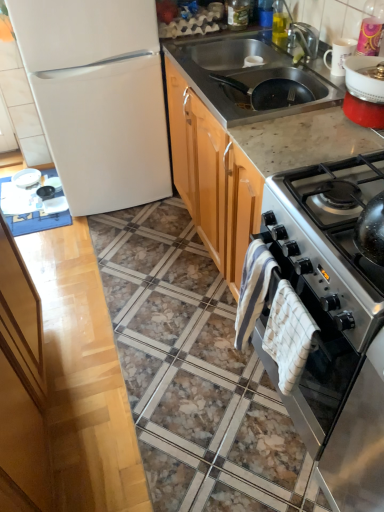
Question: From a real-world perspective, is satin silver oven at right over white glossy plate at upper left, the first appliance in the back-to-front sequence?

Choices:
 (A) yes
 (B) no

Answer: (A)

Question: Is satin silver oven at right oriented towards white glossy plate at upper left, which is counted as the 2th appliance, starting from the right?

Choices:
 (A) no
 (B) yes

Answer: (A)

Question: Are satin silver oven at right and white glossy plate at upper left, the first appliance positioned from the bottom, making contact?

Choices:
 (A) yes
 (B) no

Answer: (B)

Question: Considering the relative sizes of satin silver oven at right and white glossy plate at upper left, the 2th appliance positioned from the front, in the image provided, is satin silver oven at right bigger than white glossy plate at upper left, the 2th appliance positioned from the front,?

Choices:
 (A) yes
 (B) no

Answer: (A)

Question: Considering the relative sizes of satin silver oven at right and white glossy plate at upper left, the first appliance positioned from the bottom, in the image provided, is satin silver oven at right wider than white glossy plate at upper left, the first appliance positioned from the bottom,?

Choices:
 (A) no
 (B) yes

Answer: (B)

Question: In the image, is satin silver oven at right positioned in front of or behind white glossy plate at upper left, the first appliance in the back-to-front sequence?

Choices:
 (A) behind
 (B) front

Answer: (B)

Question: From a real-world perspective, is satin silver oven at right above or below white glossy plate at upper left, the first appliance positioned from the bottom?

Choices:
 (A) below
 (B) above

Answer: (B)

Question: From the image's perspective, is satin silver oven at right located above or below white glossy plate at upper left, the 2th appliance positioned from the front?

Choices:
 (A) above
 (B) below

Answer: (B)

Question: Is satin silver oven at right taller or shorter than white glossy plate at upper left, which is counted as the 2th appliance, starting from the right?

Choices:
 (A) tall
 (B) short

Answer: (A)

Question: Considering the positions of striped cotton towel at lower right, which is counted as the 1th blanket, starting from the left, and white checkered towel at right, the first blanket in the right-to-left sequence, in the image, is striped cotton towel at lower right, which is counted as the 1th blanket, starting from the left, wider or thinner than white checkered towel at right, the first blanket in the right-to-left sequence,?

Choices:
 (A) wide
 (B) thin

Answer: (A)

Question: Considering the positions of striped cotton towel at lower right, which is counted as the 1th blanket, starting from the left, and white checkered towel at right, the first blanket in the right-to-left sequence, in the image, is striped cotton towel at lower right, which is counted as the 1th blanket, starting from the left, bigger or smaller than white checkered towel at right, the first blanket in the right-to-left sequence,?

Choices:
 (A) small
 (B) big

Answer: (B)

Question: From their relative heights in the image, would you say striped cotton towel at lower right, positioned as the second blanket in right-to-left order, is taller or shorter than white checkered towel at right, arranged as the 2th blanket when viewed from the left?

Choices:
 (A) tall
 (B) short

Answer: (A)

Question: Do you think striped cotton towel at lower right, positioned as the second blanket in right-to-left order, is within white checkered towel at right, the first blanket in the right-to-left sequence, or outside of it?

Choices:
 (A) inside
 (B) outside

Answer: (B)

Question: From the image's perspective, relative to marble/granite countertop at center, is black matte frying pan at upper right above or below?

Choices:
 (A) below
 (B) above

Answer: (B)

Question: Looking at the image, does black matte frying pan at upper right seem bigger or smaller compared to marble/granite countertop at center?

Choices:
 (A) big
 (B) small

Answer: (B)